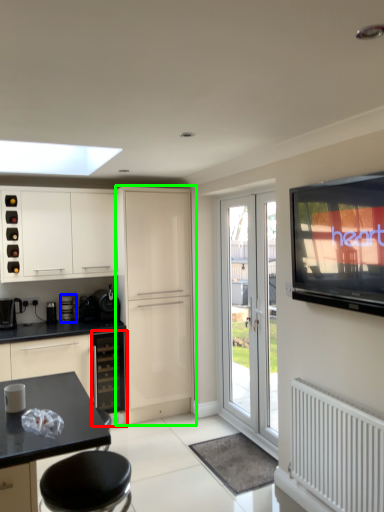
Question: Which object is the closest to the oven (highlighted by a red box)? Choose among these: appliance (highlighted by a blue box) or cabinetry (highlighted by a green box).

Choices:
 (A) appliance
 (B) cabinetry

Answer: (B)